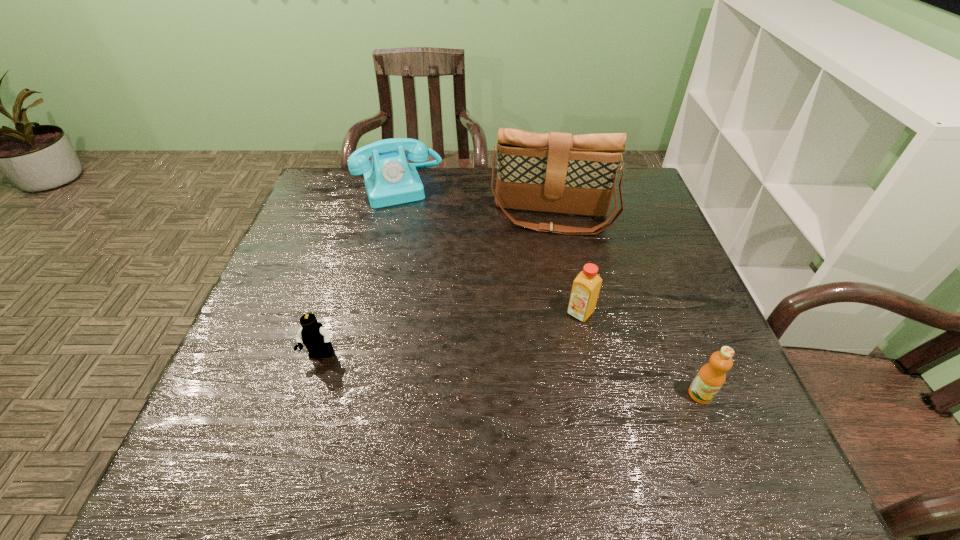
Identify the location of free space on the desktop that is between the fourth farthest object and the right orange juice and is positioned on the front and back of the left orange juice. (529, 377).

The height and width of the screenshot is (540, 960). In order to click on vacant space on the desktop that is between the fourth farthest object and the nearer orange juice and is positioned on the front-facing side of the shoulder bag in this screenshot , I will do `click(543, 378)`.

Image resolution: width=960 pixels, height=540 pixels. Identify the location of vacant spot on the desktop that is between the shortest object and the rightmost object and is positioned on the dial of the telephone. (465, 370).